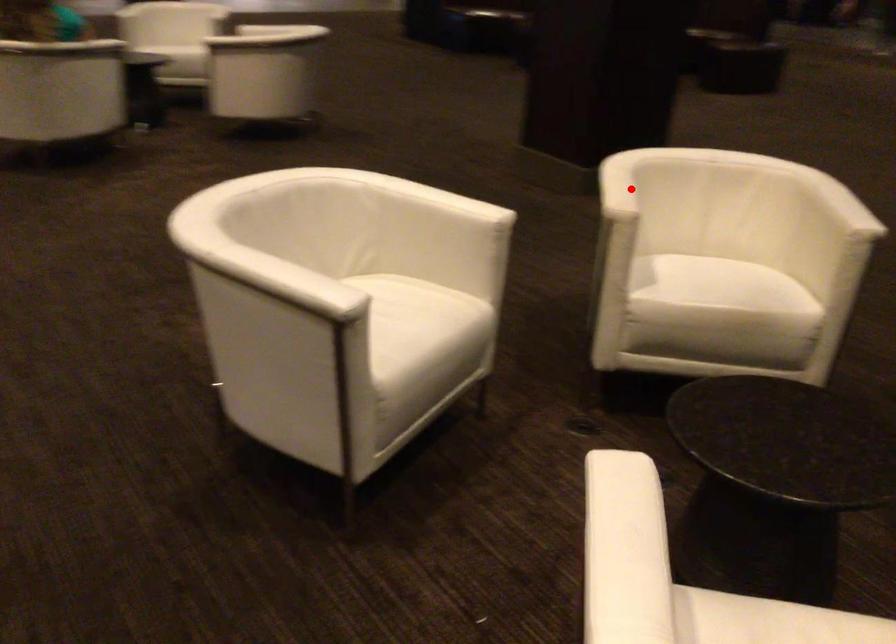
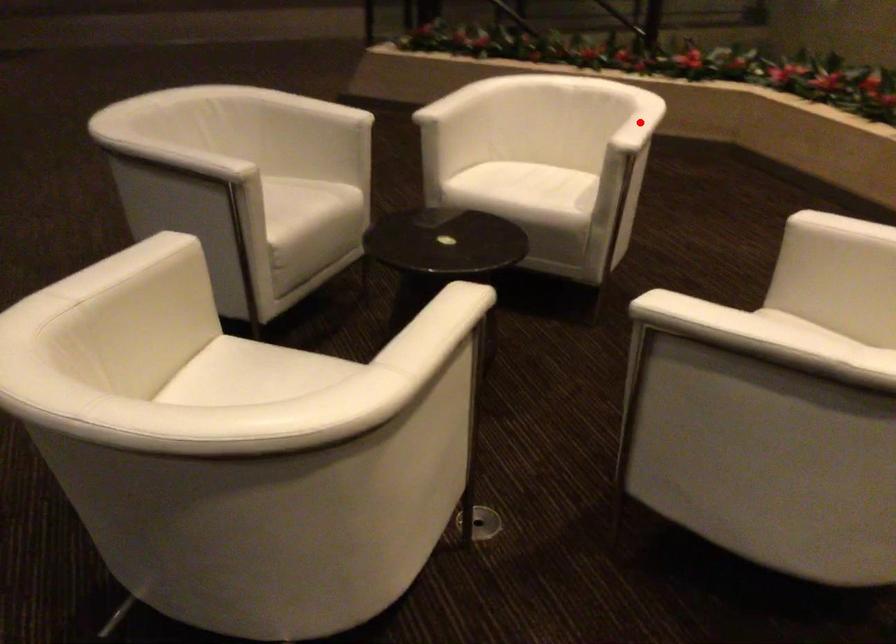
I am providing you with two images of the same scene from different viewpoints. A red point is marked on the first image and another point is marked on the second image. Does the point marked in image1 correspond to the same location as the one in image2?

No